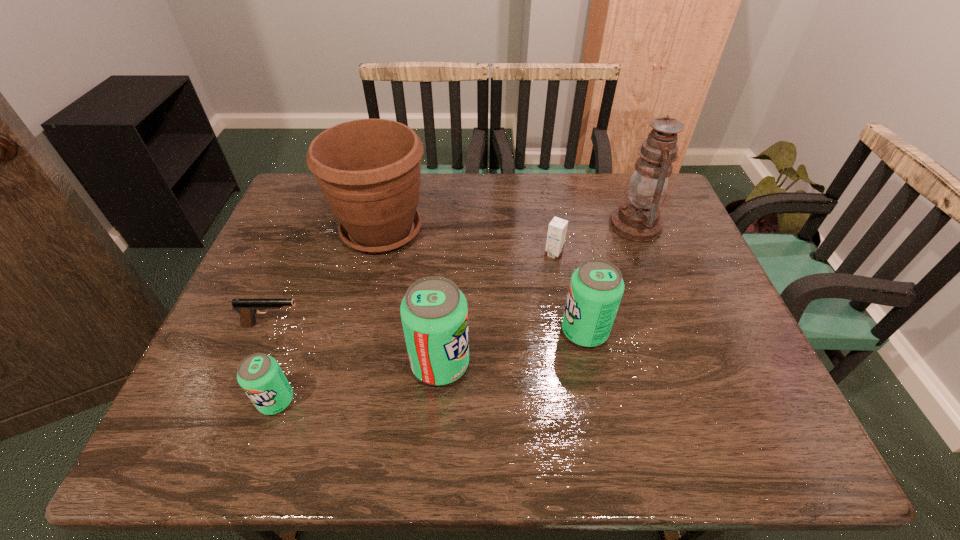
Locate an element on the screen. Image resolution: width=960 pixels, height=540 pixels. pistol that is at the left edge is located at coordinates (247, 308).

Where is `object located in the right edge section of the desktop`? object located in the right edge section of the desktop is located at coordinates (637, 219).

You are a GUI agent. You are given a task and a screenshot of the screen. Output one action in this format:
    pyautogui.click(x=<x>, y=<y>)
    Task: Click on the object present at the near left corner
    This screenshot has height=540, width=960.
    Given the screenshot: What is the action you would take?
    pyautogui.click(x=260, y=376)

The width and height of the screenshot is (960, 540). Identify the location of object that is positioned at the far right corner. (637, 219).

In the image, there is a desktop. Find the location of `vacant space at the far edge`. vacant space at the far edge is located at coordinates (573, 173).

The width and height of the screenshot is (960, 540). I want to click on vacant area at the near edge of the desktop, so 486,386.

Where is `vacant area at the left edge`? This screenshot has height=540, width=960. vacant area at the left edge is located at coordinates [293, 252].

You are a GUI agent. You are given a task and a screenshot of the screen. Output one action in this format:
    pyautogui.click(x=<x>, y=<y>)
    Task: Click on the vacant space at the right edge
    This screenshot has height=540, width=960.
    Given the screenshot: What is the action you would take?
    pyautogui.click(x=704, y=312)

In the image, there is a desktop. Identify the location of vacant space at the near left corner. (213, 374).

Where is `vacant space at the near right corner of the desktop`? vacant space at the near right corner of the desktop is located at coordinates (742, 402).